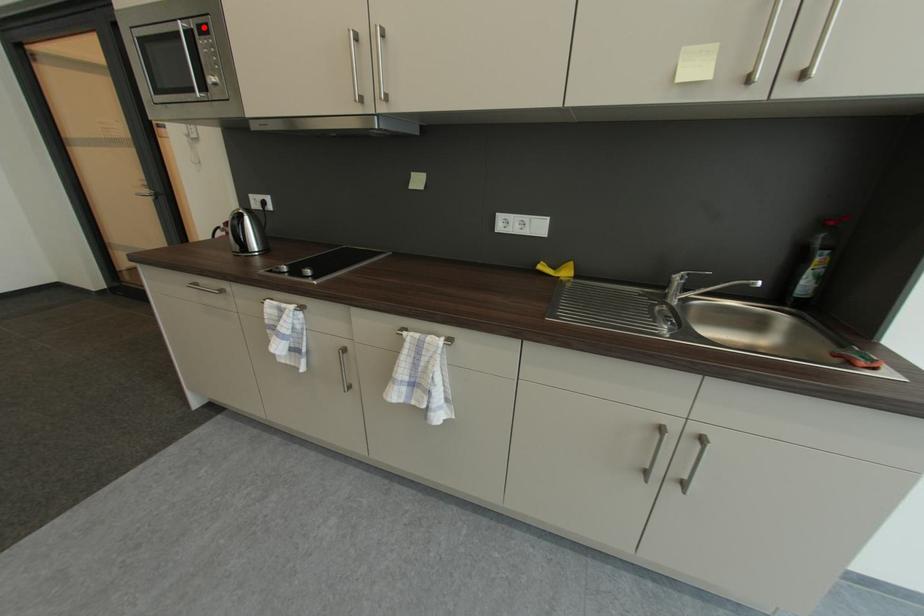
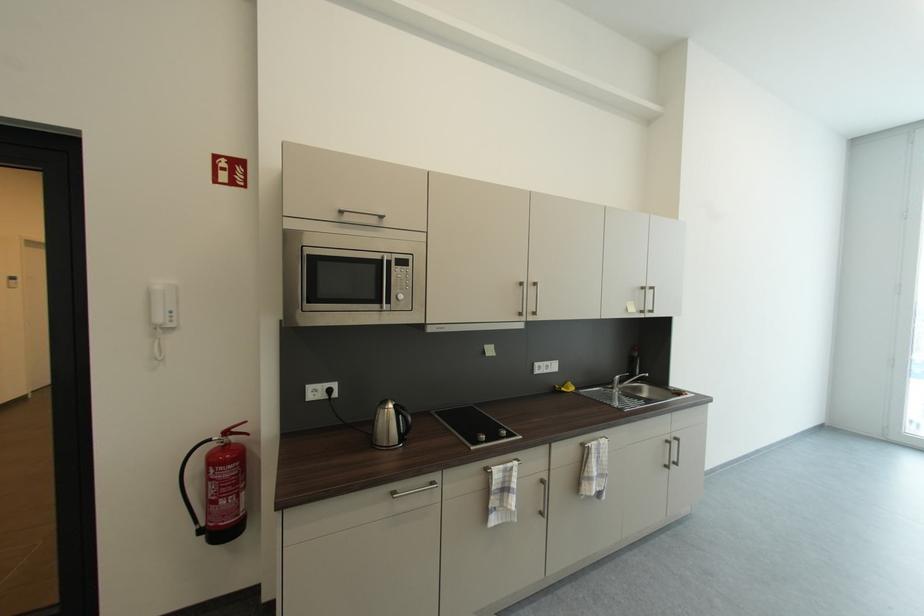
In the second image, find the point that corresponds to the highlighted location in the first image.

(403, 261)